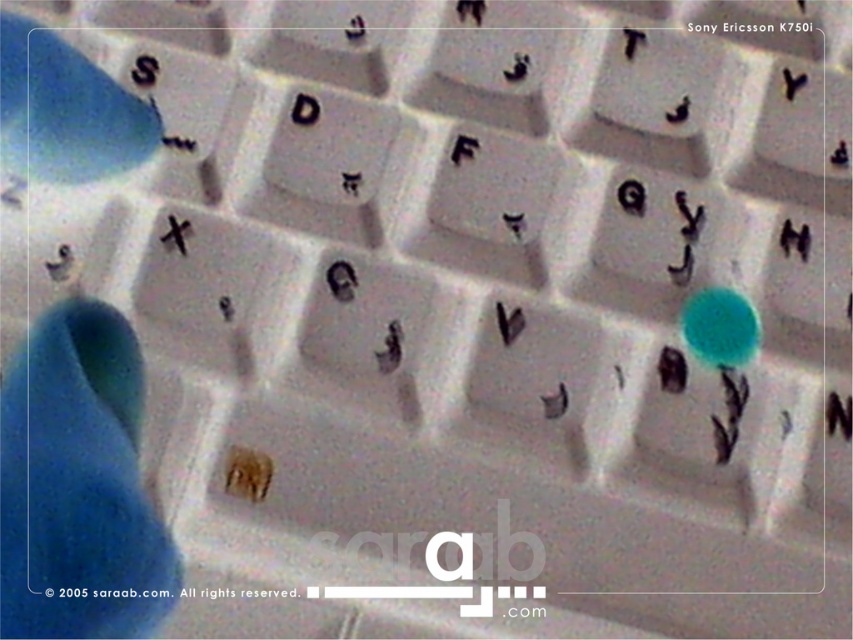
Question: Can you confirm if blue rubber glove at lower left is positioned above blue rubber hand at upper left?

Choices:
 (A) no
 (B) yes

Answer: (A)

Question: Does blue rubber glove at lower left appear on the left side of blue rubber hand at upper left?

Choices:
 (A) yes
 (B) no

Answer: (B)

Question: Which object is farther from the camera taking this photo?

Choices:
 (A) blue rubber hand at upper left
 (B) blue rubber glove at lower left

Answer: (A)

Question: Does blue rubber glove at lower left lie behind blue rubber hand at upper left?

Choices:
 (A) yes
 (B) no

Answer: (B)